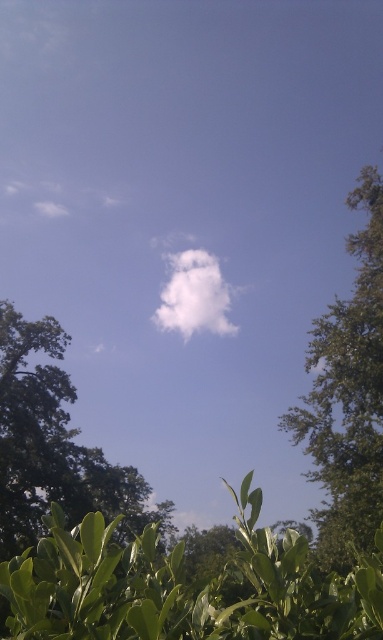
Question: Can you confirm if green leafy tree at right is thinner than green leafy tree at lower left?

Choices:
 (A) no
 (B) yes

Answer: (B)

Question: Based on their relative distances, which object is nearer to the green leafy tree at right?

Choices:
 (A) white fluffy cloud at center
 (B) green leafy tree at lower left

Answer: (B)

Question: Can you confirm if green leafy tree at lower left is wider than white fluffy cloud at center?

Choices:
 (A) no
 (B) yes

Answer: (A)

Question: Can you confirm if green leafy tree at right is positioned to the left of green leafy tree at lower left?

Choices:
 (A) no
 (B) yes

Answer: (A)

Question: Estimate the real-world distances between objects in this image. Which object is farther from the white fluffy cloud at center?

Choices:
 (A) green leafy tree at right
 (B) green leafy tree at lower left

Answer: (A)

Question: Among these points, which one is farthest from the camera?

Choices:
 (A) (186, 284)
 (B) (6, 372)

Answer: (A)